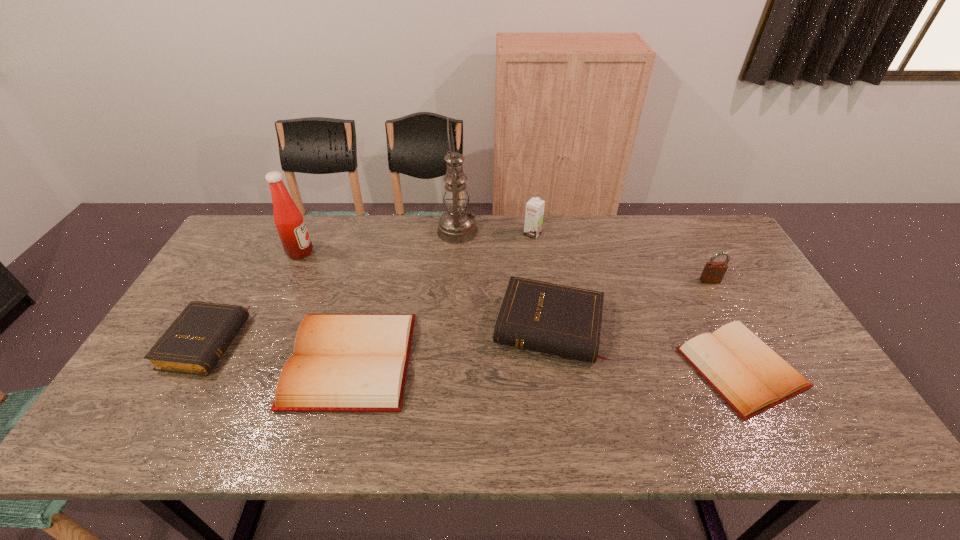
The height and width of the screenshot is (540, 960). Identify the location of the tallest object. (456, 226).

The image size is (960, 540). Find the location of `oil lamp`. oil lamp is located at coordinates (456, 226).

The height and width of the screenshot is (540, 960). I want to click on the seventh object from right to left, so click(291, 227).

At what (x,y) coordinates should I click in order to perform the action: click on condiment. Please return your answer as a coordinate pair (x, y). Looking at the image, I should click on (291, 227).

Locate an element on the screen. brown chocolate milk is located at coordinates (534, 213).

I want to click on the third tallest object, so click(x=534, y=213).

You are a GUI agent. You are given a task and a screenshot of the screen. Output one action in this format:
    pyautogui.click(x=<x>, y=<y>)
    Task: Click on the brown padlock
    The height and width of the screenshot is (540, 960).
    Given the screenshot: What is the action you would take?
    pyautogui.click(x=713, y=272)

Locate an element on the screen. The image size is (960, 540). the fourth tallest object is located at coordinates (713, 272).

The image size is (960, 540). Identify the location of the right gray Bible. (560, 320).

Locate an element on the screen. Image resolution: width=960 pixels, height=540 pixels. the fourth shortest object is located at coordinates (560, 320).